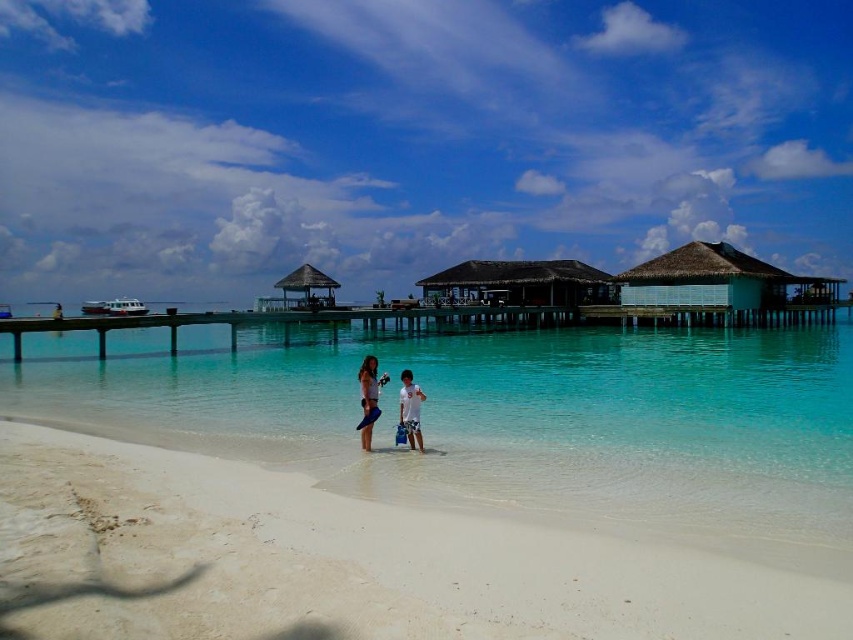
Is light blue thatched roof hut at right taller than brown thatched roof hut at center?

Yes, light blue thatched roof hut at right is taller than brown thatched roof hut at center.

Does point (679, 273) come closer to viewer compared to point (535, 268)?

Yes, point (679, 273) is in front of point (535, 268).

In order to click on light blue thatched roof hut at right in this screenshot , I will do `click(703, 278)`.

Between white sandy beach at lower center and clear blue water at center, which one has more height?

With more height is clear blue water at center.

Is the position of white sandy beach at lower center more distant than that of clear blue water at center?

No, it is in front of clear blue water at center.

At what (x,y) coordinates should I click in order to perform the action: click on white sandy beach at lower center. Please return your answer as a coordinate pair (x, y). The height and width of the screenshot is (640, 853). Looking at the image, I should click on (341, 561).

Is clear blue water at center to the left of white cotton shirt at center from the viewer's perspective?

No, clear blue water at center is not to the left of white cotton shirt at center.

Does clear blue water at center appear over white cotton shirt at center?

Correct, clear blue water at center is located above white cotton shirt at center.

Is point (312, 342) in front of point (408, 372)?

No, it is not.

The width and height of the screenshot is (853, 640). I want to click on clear blue water at center, so click(x=485, y=390).